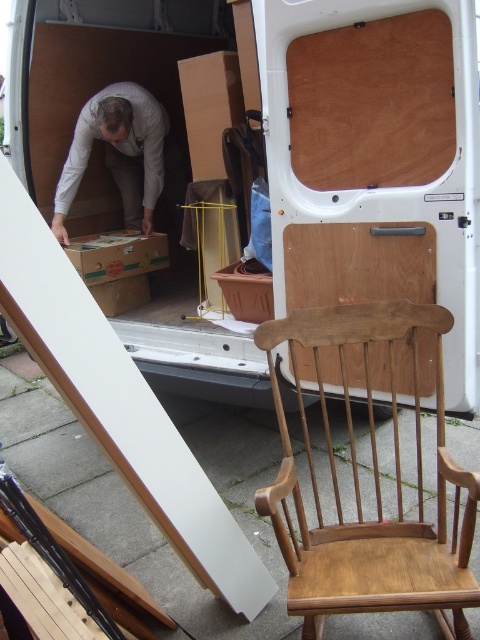
Who is lower down, light brown wooden rocking chair at center or wooden chair back at center?

light brown wooden rocking chair at center

Is light brown wooden rocking chair at center closer to the viewer compared to wooden chair back at center?

Yes, light brown wooden rocking chair at center is in front of wooden chair back at center.

Identify the location of light brown wooden rocking chair at center. (374, 486).

The width and height of the screenshot is (480, 640). What do you see at coordinates (358, 262) in the screenshot?
I see `wooden chair back at center` at bounding box center [358, 262].

Is wooden chair back at center below gray fabric bag at center?

Indeed, wooden chair back at center is positioned under gray fabric bag at center.

Is point (346, 348) positioned after point (120, 104)?

No, it is not.

Where is `wooden chair back at center`? wooden chair back at center is located at coordinates pyautogui.click(x=358, y=262).

Consider the image. Which of these two, light brown wooden rocking chair at center or gray fabric bag at center, stands shorter?

With less height is light brown wooden rocking chair at center.

Does light brown wooden rocking chair at center have a greater height compared to gray fabric bag at center?

No.

Is point (441, 433) in front of point (106, 128)?

Yes, it is.

Where is `light brown wooden rocking chair at center`? Image resolution: width=480 pixels, height=640 pixels. light brown wooden rocking chair at center is located at coordinates (374, 486).